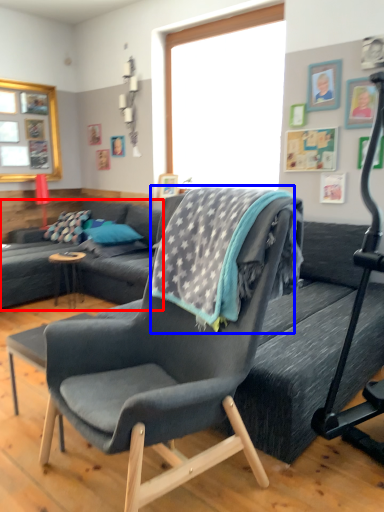
Question: Which object is closer to the camera taking this photo, studio couch (highlighted by a red box) or blanket (highlighted by a blue box)?

Choices:
 (A) studio couch
 (B) blanket

Answer: (B)